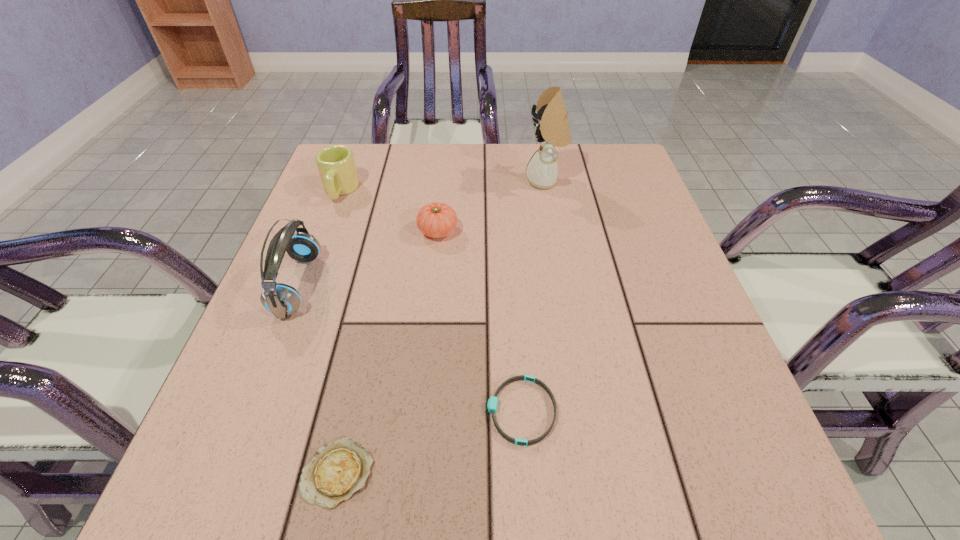
At what (x,y) coordinates should I click in order to perform the action: click on the second closest object to the third object from left to right. Please return your answer as a coordinate pair (x, y). Looking at the image, I should click on (282, 300).

Locate an element on the screen. The width and height of the screenshot is (960, 540). the second closest object relative to the fifth shortest object is located at coordinates (436, 220).

The height and width of the screenshot is (540, 960). I want to click on blank area in the image that satisfies the following two spatial constraints: 1. with the handle on the side of the quiche; 2. on the right side of the third tallest object, so click(x=234, y=472).

At what (x,y) coordinates should I click in order to perform the action: click on free location that satisfies the following two spatial constraints: 1. with the handle on the side of the mug; 2. on the left side of the shortest object. Please return your answer as a coordinate pair (x, y). This screenshot has width=960, height=540. Looking at the image, I should click on (234, 472).

At what (x,y) coordinates should I click in order to perform the action: click on vacant region that satisfies the following two spatial constraints: 1. with the handle on the side of the mug; 2. on the left side of the quiche. Please return your answer as a coordinate pair (x, y). The width and height of the screenshot is (960, 540). Looking at the image, I should click on (234, 472).

Image resolution: width=960 pixels, height=540 pixels. Identify the location of vacant space that satisfies the following two spatial constraints: 1. on the ear cups of the fourth object from right to left; 2. on the right side of the third nearest object. (225, 472).

This screenshot has width=960, height=540. I want to click on vacant space that satisfies the following two spatial constraints: 1. on the ear cups of the headset; 2. on the back side of the shortest object, so click(225, 472).

This screenshot has width=960, height=540. Identify the location of free space that satisfies the following two spatial constraints: 1. with the handle on the side of the fourth shortest object; 2. on the ear cups of the fifth shortest object. (304, 285).